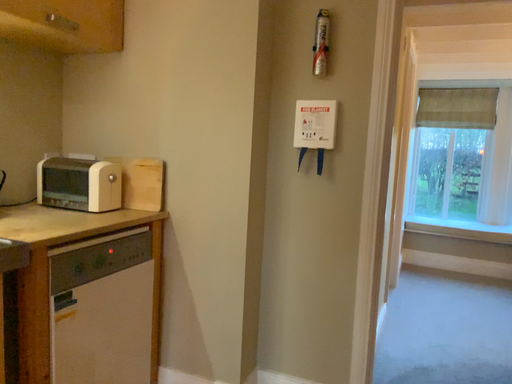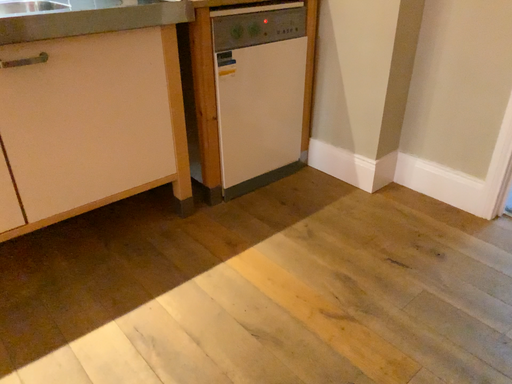
Question: Which way did the camera rotate in the video?

Choices:
 (A) rotated right
 (B) rotated left

Answer: (B)